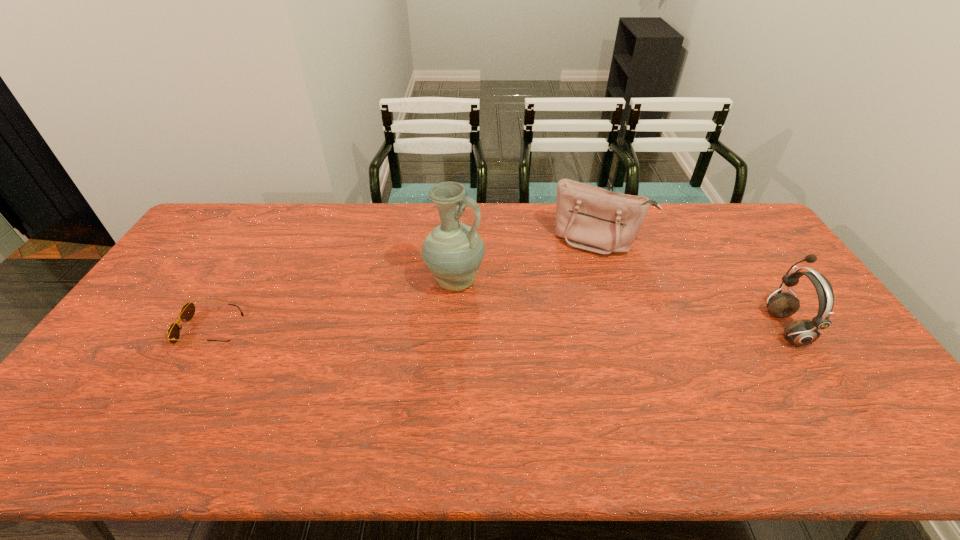
What are the coordinates of `vacant space on the desktop that is between the leftmost object and the earphone and is positioned on the handle side of the pitcher` in the screenshot? It's located at (515, 328).

This screenshot has width=960, height=540. What are the coordinates of `free space on the desktop that is between the leftmost object and the rightmost object and is positioned on the front pocket of the second object from right to left` in the screenshot? It's located at (566, 328).